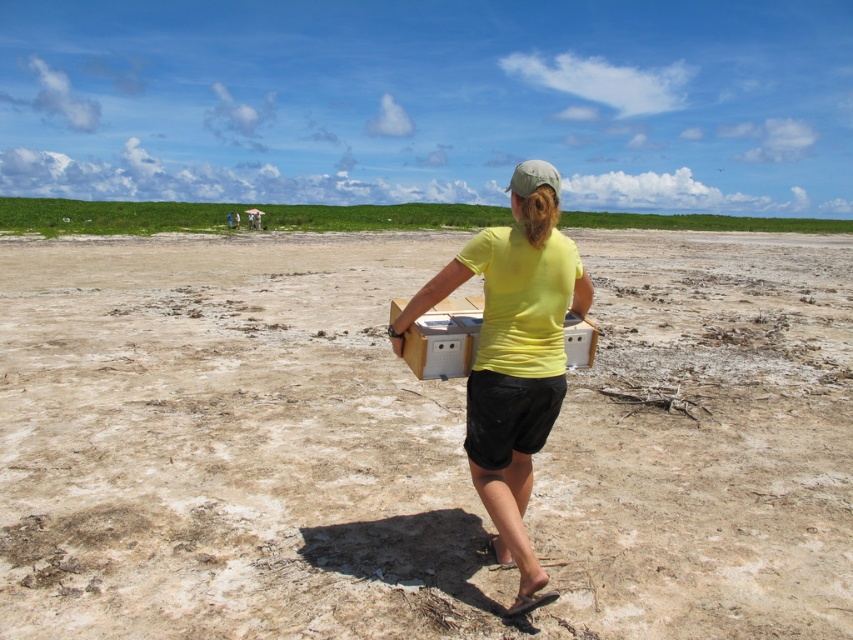
You are navigating a drone over the sandy terrain and need to drop a package at the exact location of the matte cardboard box at center. According to the coordinates provided, where should you direct the drone to drop the package?

The matte cardboard box at center is located at point (230,444), so you should direct the drone to drop the package at those coordinates.

You are a photographer planning to capture the scene of the person walking with the boxes. You need to ensure that both the black cotton shorts at lower center and the wooden box at center are clearly visible in the frame. Which object should you focus on to ensure the entire width of both objects fits within the camera view?

Since the black cotton shorts at lower center is wider than the wooden box at center, you should focus on the black cotton shorts at lower center to ensure the entire width of both objects fits within the camera view.